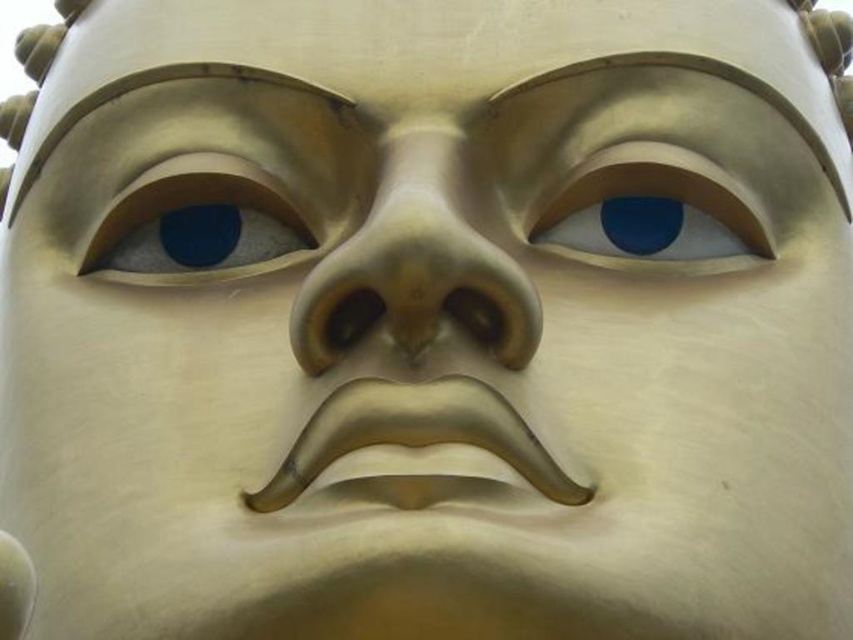
Does gold metallic nose at center come in front of matte gold eye at upper left?

Yes, gold metallic nose at center is closer to the viewer.

Who is more forward, (416,336) or (219,192)?

Point (416,336) is more forward.

The image size is (853, 640). I want to click on gold metallic nose at center, so (416, 266).

The height and width of the screenshot is (640, 853). What do you see at coordinates (416, 266) in the screenshot? I see `gold metallic nose at center` at bounding box center [416, 266].

Who is more forward, (506, 273) or (624, 244)?

Point (506, 273) is in front.

The height and width of the screenshot is (640, 853). I want to click on gold metallic nose at center, so click(x=416, y=266).

Between point (663, 186) and point (259, 204), which one is positioned in front?

Point (663, 186) is more forward.

Does metallic gold eye at upper center appear on the left side of matte gold eye at upper left?

Incorrect, metallic gold eye at upper center is not on the left side of matte gold eye at upper left.

Where is `metallic gold eye at upper center`? This screenshot has width=853, height=640. metallic gold eye at upper center is located at coordinates (656, 211).